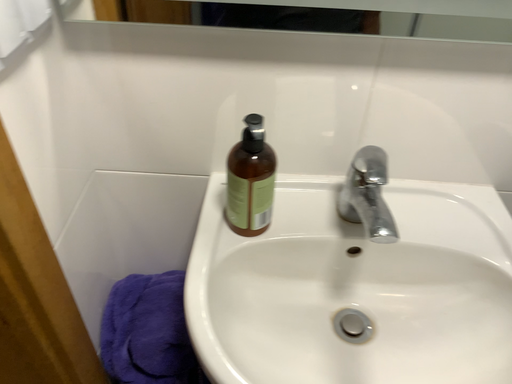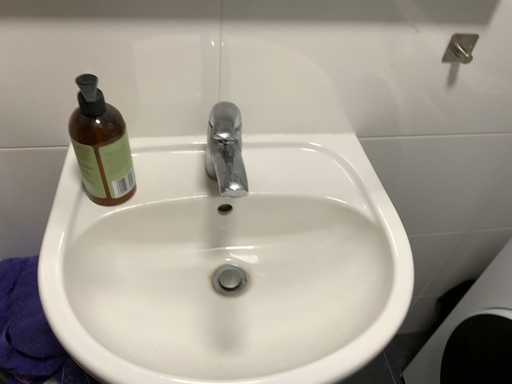
Question: Which way did the camera rotate in the video?

Choices:
 (A) rotated left
 (B) rotated right

Answer: (B)